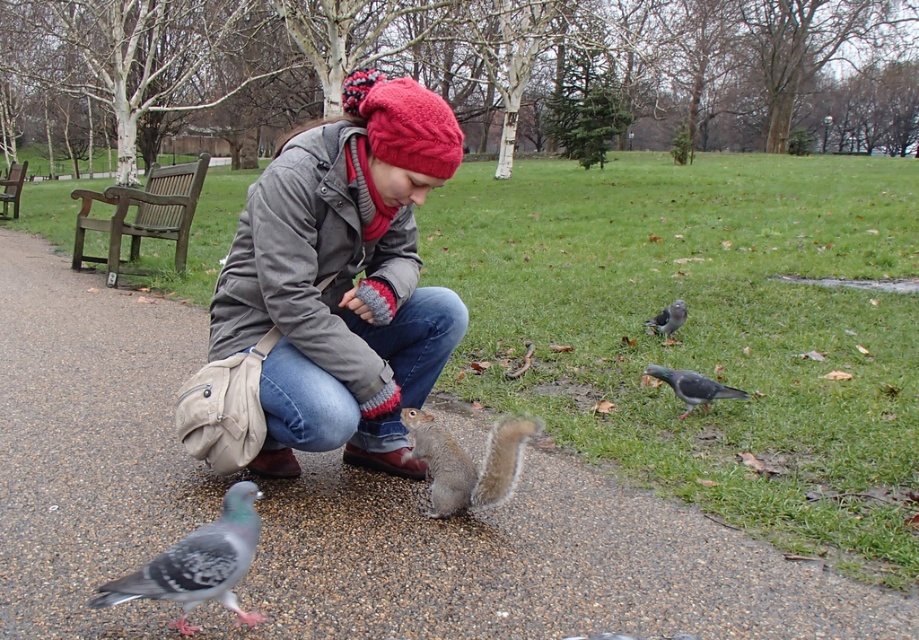
Question: Does gravel path at center have a greater width compared to speckled gray pigeon at lower left?

Choices:
 (A) yes
 (B) no

Answer: (A)

Question: Based on their relative distances, which object is nearer to the brown wooden bench at left?

Choices:
 (A) gray furry squirrel at center
 (B) knitted woolen hat at center
 (C) gray speckled pigeon at lower right
 (D) gravel path at center

Answer: (B)

Question: Which point appears farthest from the camera in this image?

Choices:
 (A) (13, 164)
 (B) (672, 305)

Answer: (A)

Question: Is gravel path at center to the left of gray furry squirrel at center from the viewer's perspective?

Choices:
 (A) yes
 (B) no

Answer: (A)

Question: Which object is positioned closest to the gray speckled pigeon at right?

Choices:
 (A) gray speckled pigeon at lower right
 (B) gray furry squirrel at center

Answer: (A)

Question: Is speckled gray pigeon at lower left wider than wooden bench at left?

Choices:
 (A) no
 (B) yes

Answer: (A)